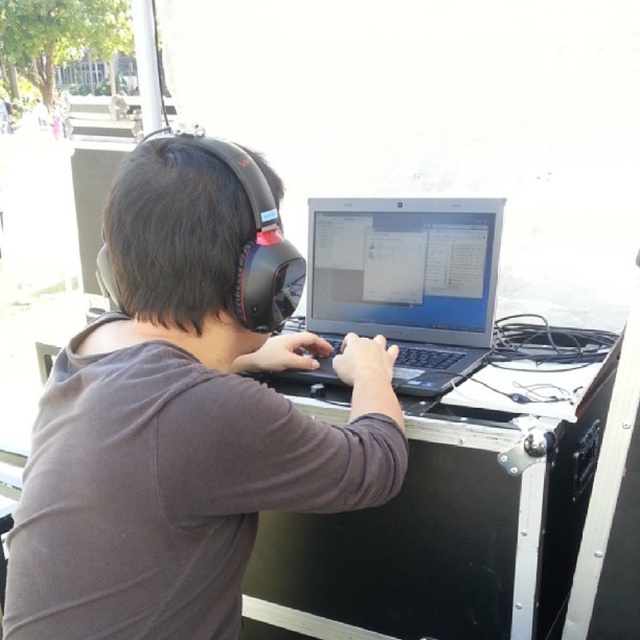
Question: Considering the real-world distances, which object is farthest from the black metal table at center?

Choices:
 (A) matte black headphones at center
 (B) satin black laptop at center

Answer: (A)

Question: Which object appears farthest from the camera in this image?

Choices:
 (A) black metal table at center
 (B) matte black headphones at center
 (C) satin black laptop at center

Answer: (C)

Question: Is matte black headphones at center further to camera compared to black metal table at center?

Choices:
 (A) no
 (B) yes

Answer: (A)

Question: Is matte black headphones at center wider than satin black laptop at center?

Choices:
 (A) yes
 (B) no

Answer: (A)

Question: Is black metal table at center thinner than satin black laptop at center?

Choices:
 (A) yes
 (B) no

Answer: (B)

Question: Which object is farther from the camera taking this photo?

Choices:
 (A) matte black headphones at center
 (B) black metal table at center

Answer: (B)